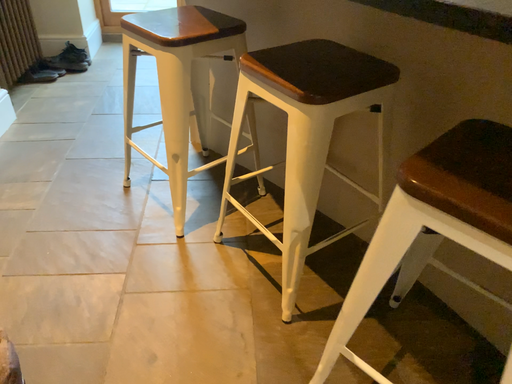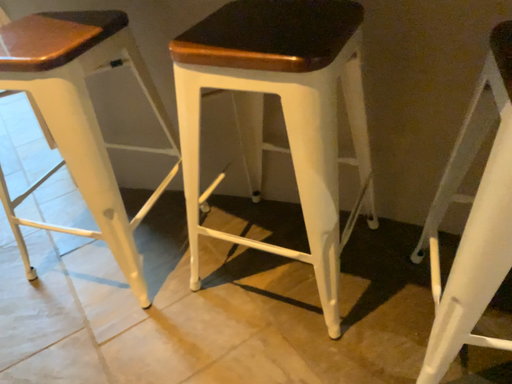
Question: How did the camera likely rotate when shooting the video?

Choices:
 (A) rotated left
 (B) rotated right

Answer: (B)